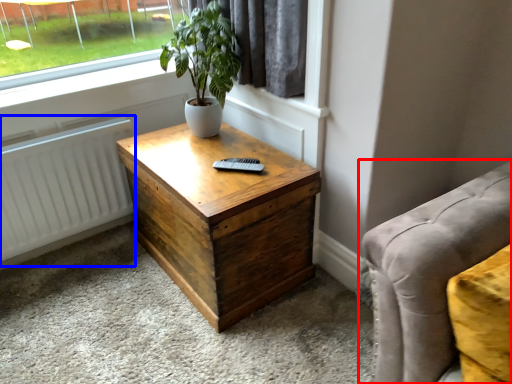
Question: Among these objects, which one is nearest to the camera, studio couch (highlighted by a red box) or radiator (highlighted by a blue box)?

Choices:
 (A) studio couch
 (B) radiator

Answer: (A)